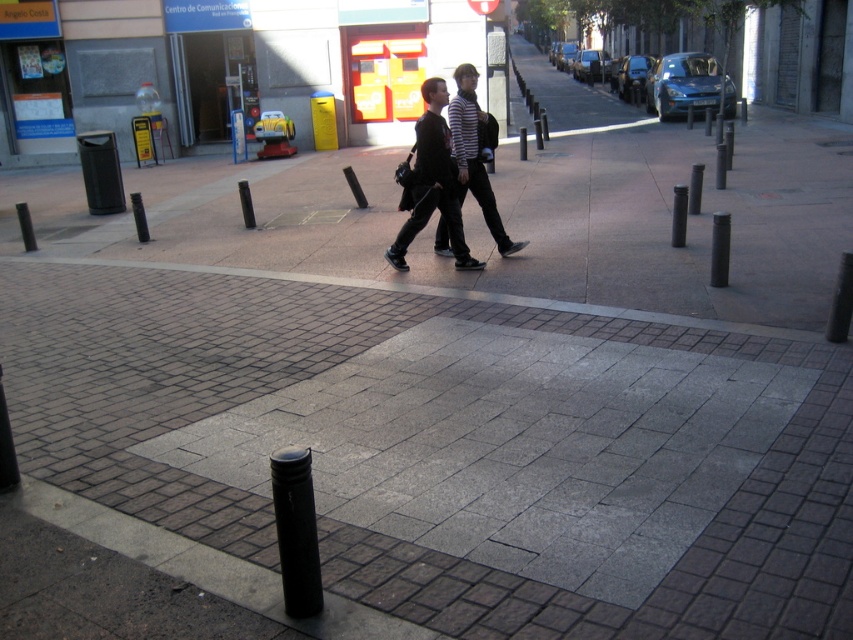
You are a delivery robot with a 1.2 meter wide package. You need to navigate through the paved area. The smooth concrete pavement at center and the matte black pants at center are in your path. Can you pass through the area between them?

The smooth concrete pavement at center is narrower than the matte black pants at center. Since your package is 1.2 meters wide, you need to check the width of the narrower space. If the pavement is narrower than 1.2 meters, you cannot pass. However, the description only states the pavement is less wide than the pants, but doesn

In the scene shown: You are a photographer setting up a tripod in the urban scene. You notice the matte black pants at center and the black matte pole at center. Which object should you avoid placing your tripod closer to in order to ensure it doesn

The matte black pants at center is taller than the black matte pole at center. To ensure the tripod is placed where it won